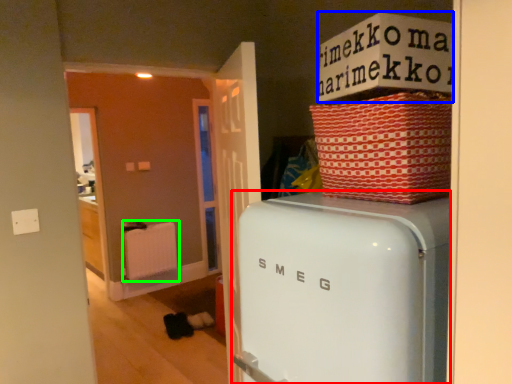
Question: Which object is positioned closest to home appliance (highlighted by a red box)? Select from cardboard box (highlighted by a blue box) and radiator (highlighted by a green box).

Choices:
 (A) cardboard box
 (B) radiator

Answer: (A)